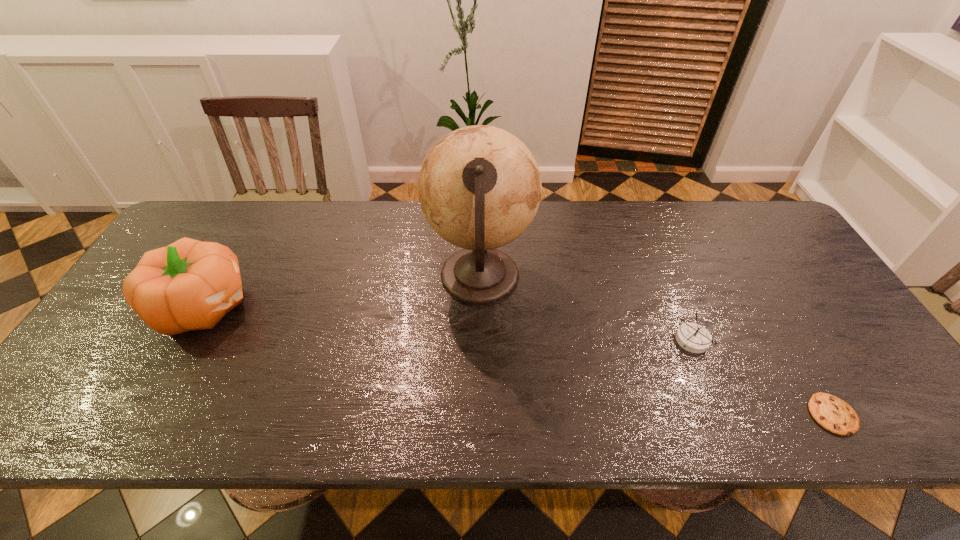
Where is `vacant area between the second tallest object and the nearest object`? The image size is (960, 540). vacant area between the second tallest object and the nearest object is located at coordinates (518, 360).

The width and height of the screenshot is (960, 540). Identify the location of free spot between the pumpkin and the nearest object. (518, 360).

Identify the location of vacant space that is in between the shortest object and the globe. (656, 346).

Identify which object is the second nearest to the leftmost object. Please provide its 2D coordinates. Your answer should be formatted as a tuple, i.e. [(x, y)], where the tuple contains the x and y coordinates of a point satisfying the conditions above.

[(692, 337)]

Where is `object that is the closest to the third object from left to right`? object that is the closest to the third object from left to right is located at coordinates (833, 414).

You are a GUI agent. You are given a task and a screenshot of the screen. Output one action in this format:
    pyautogui.click(x=<x>, y=<y>)
    Task: Click on the vacant space that satisfies the following two spatial constraints: 1. on the carved face of the third object from left to right; 2. on the right side of the pumpkin
    
    Given the screenshot: What is the action you would take?
    pyautogui.click(x=184, y=341)

Identify the location of vacant space that satisfies the following two spatial constraints: 1. on the carved face of the pumpkin; 2. on the back side of the second object from right to left. The image size is (960, 540). (184, 341).

This screenshot has width=960, height=540. I want to click on free space that satisfies the following two spatial constraints: 1. on the carved face of the compass; 2. on the right side of the pumpkin, so click(184, 341).

This screenshot has height=540, width=960. Identify the location of vacant area that satisfies the following two spatial constraints: 1. on the front-facing side of the tallest object; 2. on the back side of the rightmost object. (480, 414).

Locate an element on the screen. Image resolution: width=960 pixels, height=540 pixels. vacant space that satisfies the following two spatial constraints: 1. on the back side of the compass; 2. on the carved face of the pumpkin is located at coordinates (679, 306).